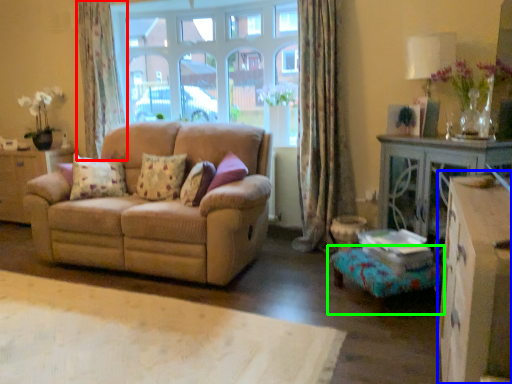
Question: Estimate the real-world distances between objects in this image. Which object is closer to curtain (highlighted by a red box), dresser (highlighted by a blue box) or footrest (highlighted by a green box)?

Choices:
 (A) dresser
 (B) footrest

Answer: (B)